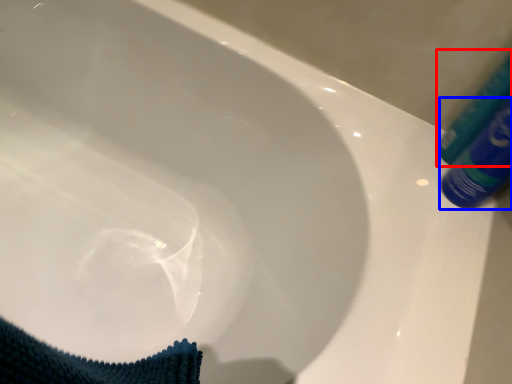
Question: Which object appears farthest to the camera in this image, tube (highlighted by a red box) or tube (highlighted by a blue box)?

Choices:
 (A) tube
 (B) tube

Answer: (A)